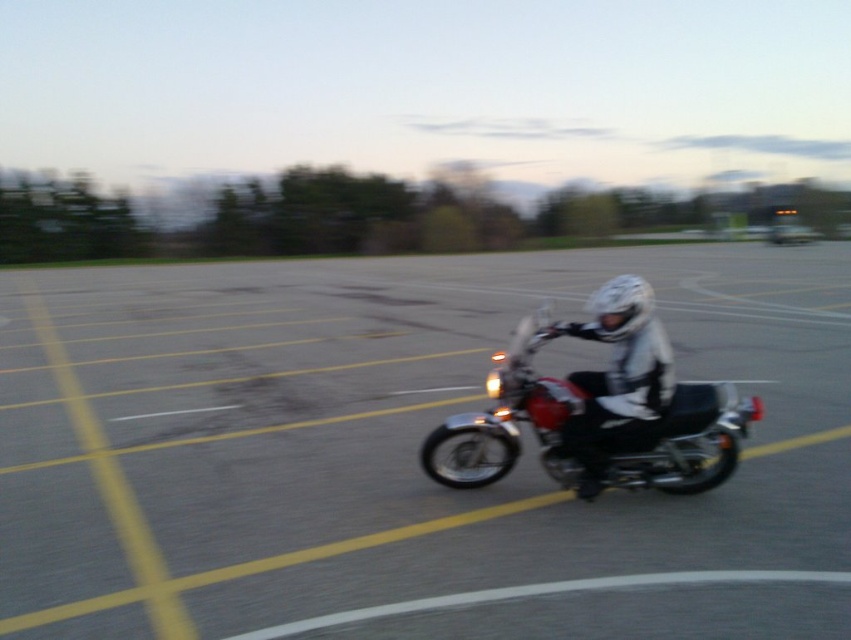
You are a photographer positioned in front of the shiny chrome motorcycle at center and the white matte helmet at upper center. Which object is closer to you?

The shiny chrome motorcycle at center is closer to you because it is positioned further to the viewer than the white matte helmet at upper center, meaning it appears nearer in the scene.

You are a photographer trying to capture the motorcycle and helmet in the scene. Since the shiny chrome motorcycle at center and the white matte helmet at center are both at the center, which object is more to the left?

The shiny chrome motorcycle at center is positioned on the left side of white matte helmet at center, so it is more to the left.